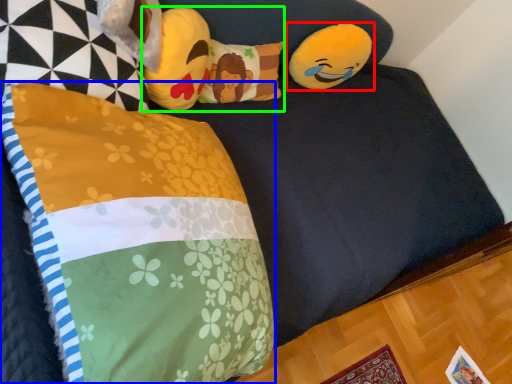
Question: Which object is the closest to the toy (highlighted by a red box)? Choose among these: pillow (highlighted by a blue box) or toy (highlighted by a green box).

Choices:
 (A) pillow
 (B) toy

Answer: (B)